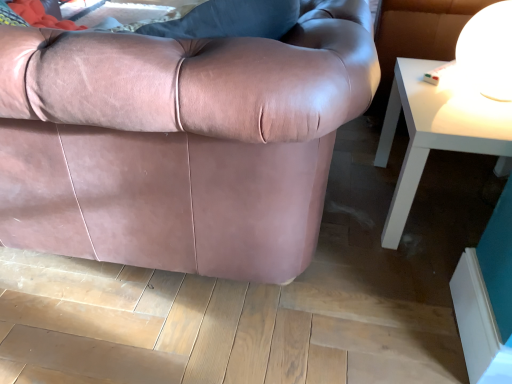
Question: Can you confirm if white glossy table lamp at upper right is positioned to the left of matte pink leather couch at center?

Choices:
 (A) yes
 (B) no

Answer: (B)

Question: From a real-world perspective, is white glossy table lamp at upper right physically above matte pink leather couch at center?

Choices:
 (A) yes
 (B) no

Answer: (A)

Question: Is the depth of white glossy table lamp at upper right greater than that of matte pink leather couch at center?

Choices:
 (A) yes
 (B) no

Answer: (A)

Question: From the image's perspective, is white glossy table lamp at upper right located beneath matte pink leather couch at center?

Choices:
 (A) yes
 (B) no

Answer: (B)

Question: Is white glossy table lamp at upper right aimed at matte pink leather couch at center?

Choices:
 (A) yes
 (B) no

Answer: (A)

Question: Choose the correct answer: Is matte pink leather couch at center inside white glossy table at upper right or outside it?

Choices:
 (A) inside
 (B) outside

Answer: (B)

Question: Does point (3, 36) appear closer or farther from the camera than point (412, 193)?

Choices:
 (A) closer
 (B) farther

Answer: (A)

Question: Considering their positions, is matte pink leather couch at center located in front of or behind white glossy table at upper right?

Choices:
 (A) behind
 (B) front

Answer: (B)

Question: Considering the positions of matte pink leather couch at center and white glossy table at upper right in the image, is matte pink leather couch at center taller or shorter than white glossy table at upper right?

Choices:
 (A) short
 (B) tall

Answer: (B)

Question: From the image's perspective, is white glossy table at upper right positioned above or below matte pink leather couch at center?

Choices:
 (A) below
 (B) above

Answer: (A)

Question: Is white glossy table at upper right bigger or smaller than matte pink leather couch at center?

Choices:
 (A) big
 (B) small

Answer: (B)

Question: Is white glossy table at upper right in front of or behind matte pink leather couch at center in the image?

Choices:
 (A) front
 (B) behind

Answer: (B)

Question: Is white glossy table at upper right to the left or to the right of matte pink leather couch at center in the image?

Choices:
 (A) right
 (B) left

Answer: (A)

Question: Is white glossy table at upper right wider or thinner than white glossy table lamp at upper right?

Choices:
 (A) thin
 (B) wide

Answer: (B)

Question: From the image's perspective, relative to white glossy table lamp at upper right, is white glossy table at upper right above or below?

Choices:
 (A) below
 (B) above

Answer: (A)